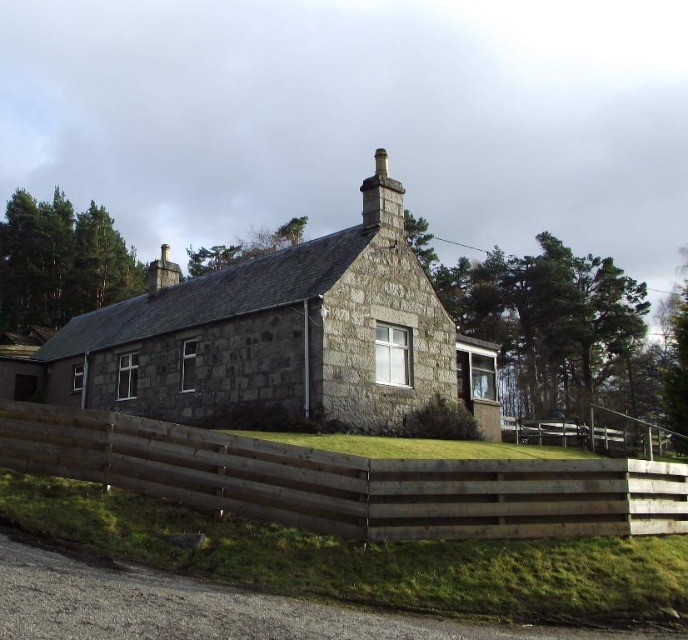
Consider the image. You are a visitor approaching the gray stone cottage at center and the brown wooden fence at lower center. Which structure appears bigger to you?

The gray stone cottage at center appears bigger than the brown wooden fence at lower center because it has a larger size compared to it.

You are a delivery person trying to deliver a package to the gray stone cottage at center. The package requires a signature, so you need to locate the front door. Based on the scene description, where would you find the front door in relation to the gray stone chimney at upper center?

The front door is on the right side of the gray stone cottage at center, which is to the right of the gray stone chimney at upper center since the cottage is larger than the chimney.